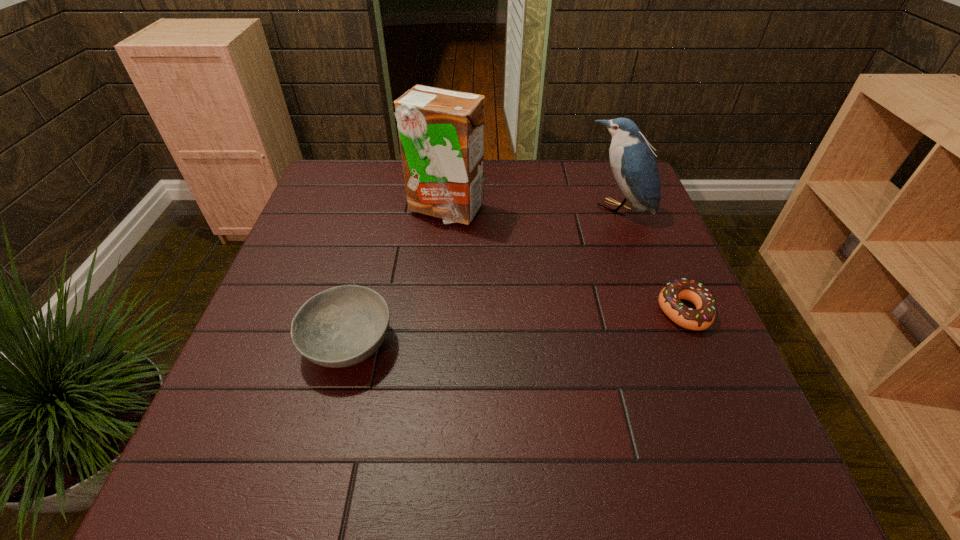
The height and width of the screenshot is (540, 960). I want to click on free space at the left edge, so click(x=329, y=258).

Identify the location of free location at the right edge. (651, 225).

Locate an element on the screen. vacant space at the near left corner of the desktop is located at coordinates (227, 390).

Locate an element on the screen. Image resolution: width=960 pixels, height=540 pixels. vacant space at the far right corner is located at coordinates (592, 170).

Where is `free spot between the doughnut and the carton`? The height and width of the screenshot is (540, 960). free spot between the doughnut and the carton is located at coordinates (564, 260).

The width and height of the screenshot is (960, 540). Identify the location of vacant area between the tallest object and the bowl. (396, 276).

Find the location of a particular element. vacant area between the second tallest object and the second shortest object is located at coordinates (483, 276).

Identify the location of unoccupied area between the doughnut and the bowl. Image resolution: width=960 pixels, height=540 pixels. (516, 327).

The width and height of the screenshot is (960, 540). In order to click on free spot between the third tallest object and the doughnut in this screenshot , I will do `click(516, 327)`.

You are a GUI agent. You are given a task and a screenshot of the screen. Output one action in this format:
    pyautogui.click(x=<x>, y=<y>)
    Task: Click on the empty space between the second tallest object and the tallest object
    
    Given the screenshot: What is the action you would take?
    pyautogui.click(x=532, y=209)